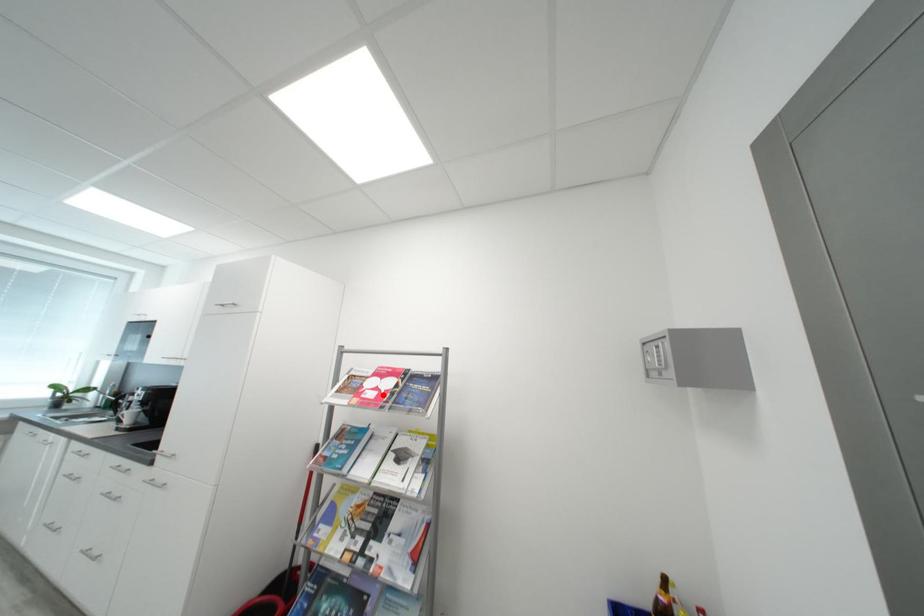
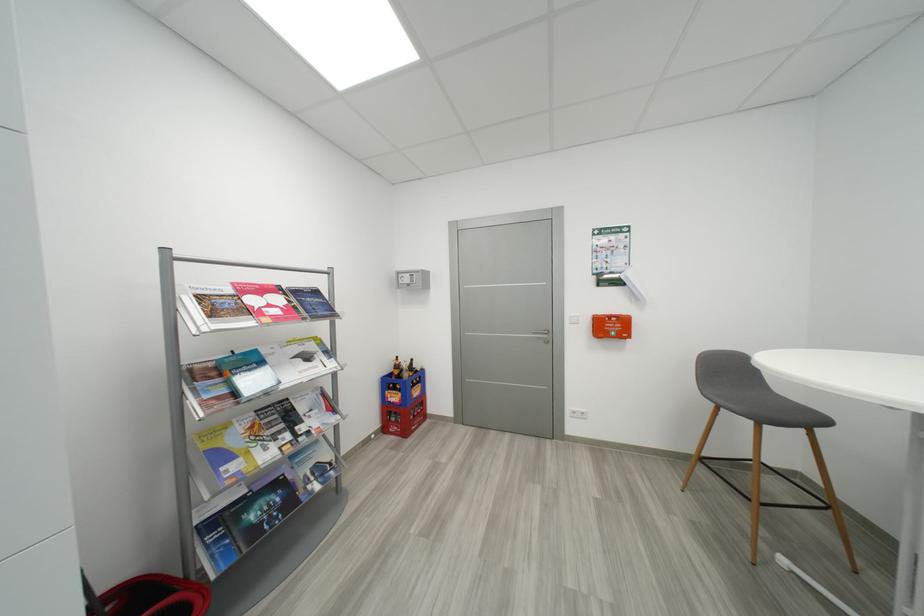
In the second image, find the point that corresponds to the highlighted location in the first image.

(286, 310)